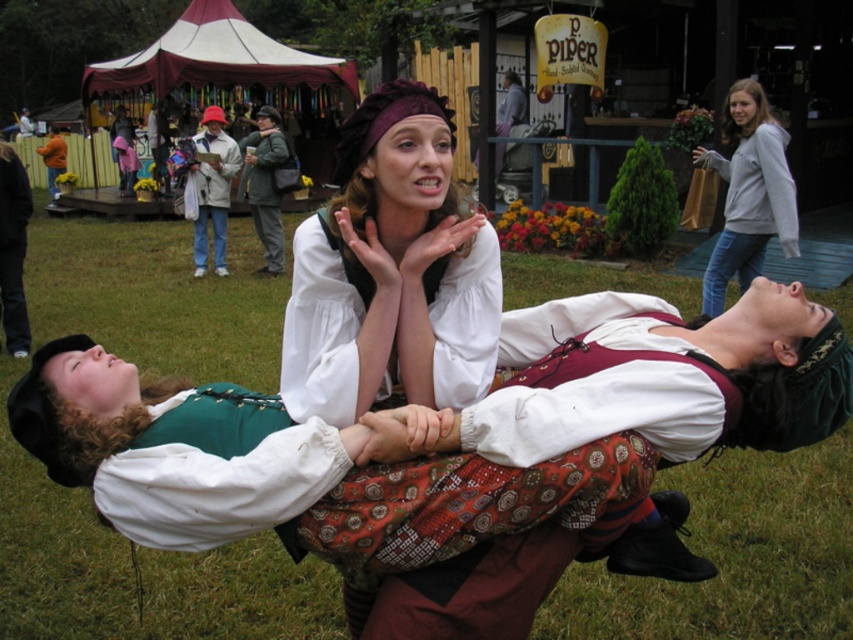
Question: Among these points, which one is farthest from the camera?

Choices:
 (A) (746, 92)
 (B) (474, 388)
 (C) (51, 141)

Answer: (C)

Question: Does green fabric coat at center appear under orange cotton sweater at left?

Choices:
 (A) no
 (B) yes

Answer: (B)

Question: Which point is farther to the camera?

Choices:
 (A) (485, 387)
 (B) (50, 195)
 (C) (247, 144)
 (D) (19, 195)

Answer: (B)

Question: Where is black fabric pants at left located in relation to matte black hat at upper left in the image?

Choices:
 (A) above
 (B) below

Answer: (B)

Question: Estimate the real-world distances between objects in this image. Which object is closer to the green fabric coat at center?

Choices:
 (A) green grass at center
 (B) white cotton coat at center
 (C) orange cotton sweater at left

Answer: (B)

Question: Is green grass at center bigger than white cotton coat at center?

Choices:
 (A) no
 (B) yes

Answer: (B)